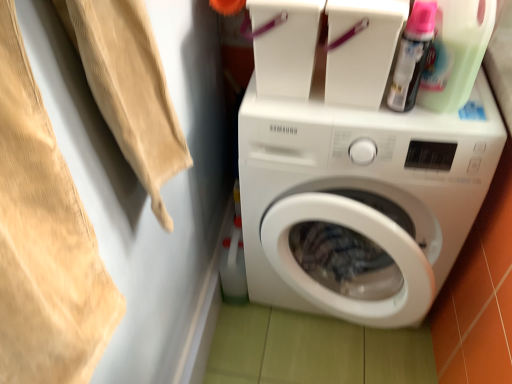
Based on the photo, what is the approximate height of green translucent bottle at upper right, placed as the 2th cleaning product when sorted from left to right?

green translucent bottle at upper right, placed as the 2th cleaning product when sorted from left to right, is 10.44 inches tall.

Measure the distance between white glossy washing machine at center and camera.

white glossy washing machine at center and camera are 33.53 inches apart from each other.

Image resolution: width=512 pixels, height=384 pixels. What do you see at coordinates (354, 171) in the screenshot?
I see `white glossy washing machine at center` at bounding box center [354, 171].

This screenshot has width=512, height=384. In order to click on green translucent bottle at upper right, marked as the first cleaning product in a right-to-left arrangement in this screenshot , I will do `click(456, 53)`.

From the image's perspective, is translucent plastic spray can at upper right, the 2th cleaning product positioned from the right, over white glossy washing machine at center?

Yes, from the image's perspective, translucent plastic spray can at upper right, the 2th cleaning product positioned from the right, is on top of white glossy washing machine at center.

Between translucent plastic spray can at upper right, which is counted as the first cleaning product, starting from the left, and white glossy washing machine at center, which one appears on the left side from the viewer's perspective?

white glossy washing machine at center.

Choose the correct answer: Is translucent plastic spray can at upper right, which is counted as the first cleaning product, starting from the left, inside white glossy washing machine at center or outside it?

The correct answer is: outside.

Is beige cotton towel at upper left bigger than white glossy washing machine at center?

No.

Who is more distant, beige cotton towel at upper left or white glossy washing machine at center?

white glossy washing machine at center is more distant.

At what (x,y) coordinates should I click in order to perform the action: click on washing machine that is on the right side of beige cotton towel at upper left. Please return your answer as a coordinate pair (x, y). Image resolution: width=512 pixels, height=384 pixels. Looking at the image, I should click on (354, 171).

Does beige cotton towel at upper left have a lesser width compared to white glossy washing machine at center?

Correct, the width of beige cotton towel at upper left is less than that of white glossy washing machine at center.

From the image's perspective, which is below, translucent plastic spray can at upper right, the 2th cleaning product positioned from the right, or beige cotton towel at upper left?

beige cotton towel at upper left appears lower in the image.

Can you tell me how much translucent plastic spray can at upper right, the 2th cleaning product positioned from the right, and beige cotton towel at upper left differ in facing direction?

The angle between the facing direction of translucent plastic spray can at upper right, the 2th cleaning product positioned from the right, and the facing direction of beige cotton towel at upper left is 0.000108 degrees.

In terms of height, does translucent plastic spray can at upper right, the 2th cleaning product positioned from the right, look taller or shorter compared to beige cotton towel at upper left?

Considering their sizes, translucent plastic spray can at upper right, the 2th cleaning product positioned from the right, has less height than beige cotton towel at upper left.

Does point (400, 109) come farther from viewer compared to point (16, 211)?

Yes, it is.

Would you say green translucent bottle at upper right, marked as the first cleaning product in a right-to-left arrangement, is inside or outside white glossy washing machine at center?

green translucent bottle at upper right, marked as the first cleaning product in a right-to-left arrangement, lies outside white glossy washing machine at center.

How many degrees apart are the facing directions of green translucent bottle at upper right, placed as the 2th cleaning product when sorted from left to right, and white glossy washing machine at center?

They differ by 8.11e-05 degrees in their facing directions.

Is green translucent bottle at upper right, marked as the first cleaning product in a right-to-left arrangement, positioned with its back to white glossy washing machine at center?

No.

From a real-world perspective, is green translucent bottle at upper right, marked as the first cleaning product in a right-to-left arrangement, on white glossy washing machine at center?

Yes, from a real-world perspective, green translucent bottle at upper right, marked as the first cleaning product in a right-to-left arrangement, is on top of white glossy washing machine at center.

In the scene shown: Is translucent plastic spray can at upper right, which is counted as the first cleaning product, starting from the left, taller than green translucent bottle at upper right, placed as the 2th cleaning product when sorted from left to right?

Indeed, translucent plastic spray can at upper right, which is counted as the first cleaning product, starting from the left, has a greater height compared to green translucent bottle at upper right, placed as the 2th cleaning product when sorted from left to right.

From the image's perspective, between translucent plastic spray can at upper right, which is counted as the first cleaning product, starting from the left, and green translucent bottle at upper right, marked as the first cleaning product in a right-to-left arrangement, who is located below?

translucent plastic spray can at upper right, which is counted as the first cleaning product, starting from the left.

Can you confirm if translucent plastic spray can at upper right, which is counted as the first cleaning product, starting from the left, is positioned to the left of green translucent bottle at upper right, placed as the 2th cleaning product when sorted from left to right?

Indeed, translucent plastic spray can at upper right, which is counted as the first cleaning product, starting from the left, is positioned on the left side of green translucent bottle at upper right, placed as the 2th cleaning product when sorted from left to right.

Measure the distance between translucent plastic spray can at upper right, which is counted as the first cleaning product, starting from the left, and green translucent bottle at upper right, placed as the 2th cleaning product when sorted from left to right.

translucent plastic spray can at upper right, which is counted as the first cleaning product, starting from the left, and green translucent bottle at upper right, placed as the 2th cleaning product when sorted from left to right, are 2.18 inches apart.

Are green translucent bottle at upper right, marked as the first cleaning product in a right-to-left arrangement, and beige cotton towel at upper left far apart?

They are positioned close to each other.

You are a GUI agent. You are given a task and a screenshot of the screen. Output one action in this format:
    pyautogui.click(x=<x>, y=<y>)
    Task: Click on the cleaning product that is the 1st object located behind the beige cotton towel at upper left
    Image resolution: width=512 pixels, height=384 pixels.
    Given the screenshot: What is the action you would take?
    pyautogui.click(x=456, y=53)

From a real-world perspective, is green translucent bottle at upper right, placed as the 2th cleaning product when sorted from left to right, under beige cotton towel at upper left?

Yes, from a real-world perspective, green translucent bottle at upper right, placed as the 2th cleaning product when sorted from left to right, is under beige cotton towel at upper left.

From the picture: How different are the orientations of green translucent bottle at upper right, marked as the first cleaning product in a right-to-left arrangement, and beige cotton towel at upper left in degrees?

3.82e-05 degrees separate the facing orientations of green translucent bottle at upper right, marked as the first cleaning product in a right-to-left arrangement, and beige cotton towel at upper left.

From a real-world perspective, is green translucent bottle at upper right, marked as the first cleaning product in a right-to-left arrangement, above or below translucent plastic spray can at upper right, which is counted as the first cleaning product, starting from the left?

green translucent bottle at upper right, marked as the first cleaning product in a right-to-left arrangement, is below translucent plastic spray can at upper right, which is counted as the first cleaning product, starting from the left.

Is green translucent bottle at upper right, marked as the first cleaning product in a right-to-left arrangement, at the left side of translucent plastic spray can at upper right, which is counted as the first cleaning product, starting from the left?

No, green translucent bottle at upper right, marked as the first cleaning product in a right-to-left arrangement, is not to the left of translucent plastic spray can at upper right, which is counted as the first cleaning product, starting from the left.

Is the surface of green translucent bottle at upper right, marked as the first cleaning product in a right-to-left arrangement, in direct contact with translucent plastic spray can at upper right, the 2th cleaning product positioned from the right?

Yes, green translucent bottle at upper right, marked as the first cleaning product in a right-to-left arrangement, is right next to translucent plastic spray can at upper right, the 2th cleaning product positioned from the right, and making contact.

The image size is (512, 384). Identify the location of washing machine on the left of translucent plastic spray can at upper right, which is counted as the first cleaning product, starting from the left. (354, 171).

Locate an element on the screen. clothing lying above the white glossy washing machine at center (from the image's perspective) is located at coordinates point(44,241).

Based on their spatial positions, is green translucent bottle at upper right, marked as the first cleaning product in a right-to-left arrangement, or beige cotton towel at upper left closer to translucent plastic spray can at upper right, which is counted as the first cleaning product, starting from the left?

Among the two, green translucent bottle at upper right, marked as the first cleaning product in a right-to-left arrangement, is located nearer to translucent plastic spray can at upper right, which is counted as the first cleaning product, starting from the left.

Consider the image. From the image, which object appears to be farther from beige cotton towel at upper left, white glossy washing machine at center or translucent plastic spray can at upper right, the 2th cleaning product positioned from the right?

translucent plastic spray can at upper right, the 2th cleaning product positioned from the right, lies further to beige cotton towel at upper left than the other object.

From the image, which object appears to be nearer to white glossy washing machine at center, green translucent bottle at upper right, placed as the 2th cleaning product when sorted from left to right, or beige cotton towel at upper left?

green translucent bottle at upper right, placed as the 2th cleaning product when sorted from left to right.

Looking at the image, which one is located closer to white glossy washing machine at center, green translucent bottle at upper right, placed as the 2th cleaning product when sorted from left to right, or translucent plastic spray can at upper right, which is counted as the first cleaning product, starting from the left?

green translucent bottle at upper right, placed as the 2th cleaning product when sorted from left to right.

Which object lies further to the anchor point white glossy washing machine at center, translucent plastic spray can at upper right, the 2th cleaning product positioned from the right, or beige cotton towel at upper left?

beige cotton towel at upper left.

Considering their positions, is beige cotton towel at upper left positioned further to white glossy washing machine at center than green translucent bottle at upper right, marked as the first cleaning product in a right-to-left arrangement?

The object further to white glossy washing machine at center is beige cotton towel at upper left.

Which object lies further to the anchor point green translucent bottle at upper right, placed as the 2th cleaning product when sorted from left to right, white glossy washing machine at center or translucent plastic spray can at upper right, the 2th cleaning product positioned from the right?

white glossy washing machine at center is positioned further to the anchor green translucent bottle at upper right, placed as the 2th cleaning product when sorted from left to right.

Estimate the real-world distances between objects in this image. Which object is further from green translucent bottle at upper right, marked as the first cleaning product in a right-to-left arrangement, white glossy washing machine at center or beige cotton towel at upper left?

beige cotton towel at upper left.

Locate an element on the screen. cleaning product between beige cotton towel at upper left and green translucent bottle at upper right, placed as the 2th cleaning product when sorted from left to right, from left to right is located at coordinates (x=412, y=55).

Identify the location of cleaning product that lies between green translucent bottle at upper right, placed as the 2th cleaning product when sorted from left to right, and white glossy washing machine at center from top to bottom. The image size is (512, 384). (412, 55).

Locate an element on the screen. Image resolution: width=512 pixels, height=384 pixels. washing machine between beige cotton towel at upper left and green translucent bottle at upper right, placed as the 2th cleaning product when sorted from left to right is located at coordinates point(354,171).